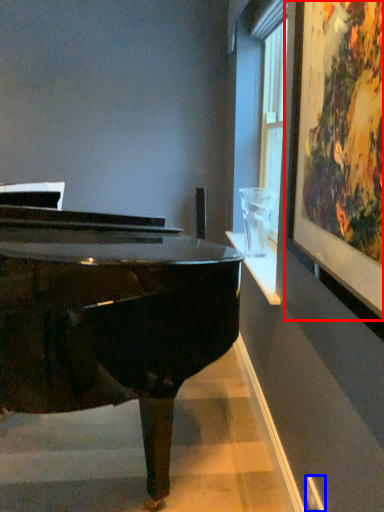
Question: Which object is closer to the camera taking this photo, picture frame (highlighted by a red box) or power outlet (highlighted by a blue box)?

Choices:
 (A) picture frame
 (B) power outlet

Answer: (A)